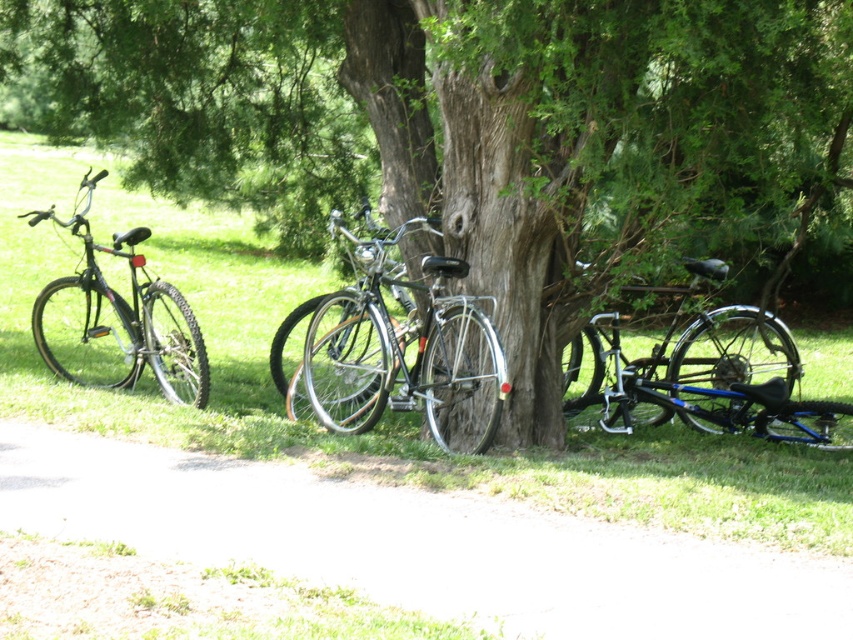
From the picture: You are standing on the paved path in the scene and want to take a photo of the shiny silver bicycle at center without the green textured tree at center blocking the view. Is this possible?

The green textured tree at center is closer to the viewer than the shiny silver bicycle at center, so the tree would block the view of the bicycle. You would need to move to a position where the tree is not between you and the bicycle to take the photo without obstruction.

You are a park visitor who wants to retrieve your bicycle. You see the blue metallic bicycle at right and the matte black bicycle at left. Which bicycle is located more to the right side?

The blue metallic bicycle at right is positioned on the right side of the matte black bicycle at left, so it is more to the right.